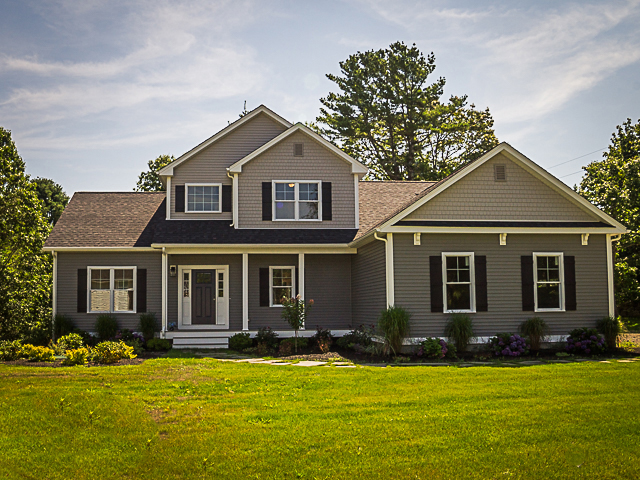
This screenshot has width=640, height=480. What are the coordinates of `house windows` in the screenshot? It's located at (193, 198), (294, 196), (456, 277), (547, 279), (288, 281), (123, 288), (91, 283).